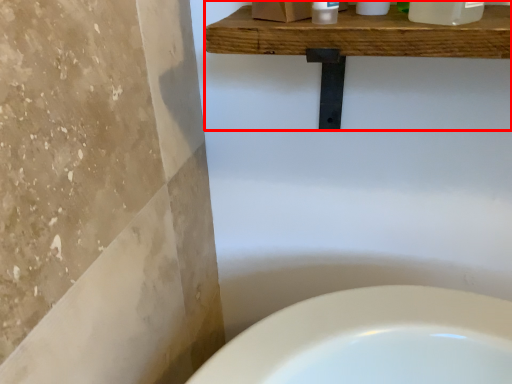
Question: From the image's perspective, what is the correct spatial relationship of balustrade (annotated by the red box) in relation to cleaning product?

Choices:
 (A) below
 (B) above

Answer: (A)